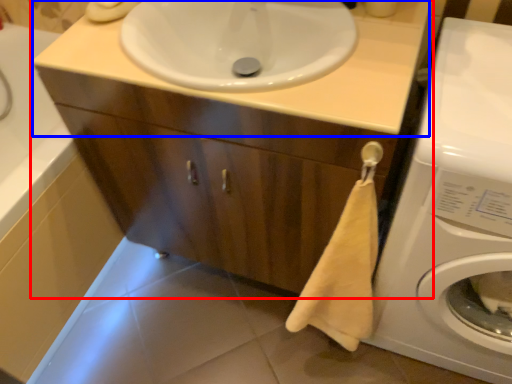
Question: Which point is further to the camera, bathroom cabinet (highlighted by a red box) or counter top (highlighted by a blue box)?

Choices:
 (A) bathroom cabinet
 (B) counter top

Answer: (B)